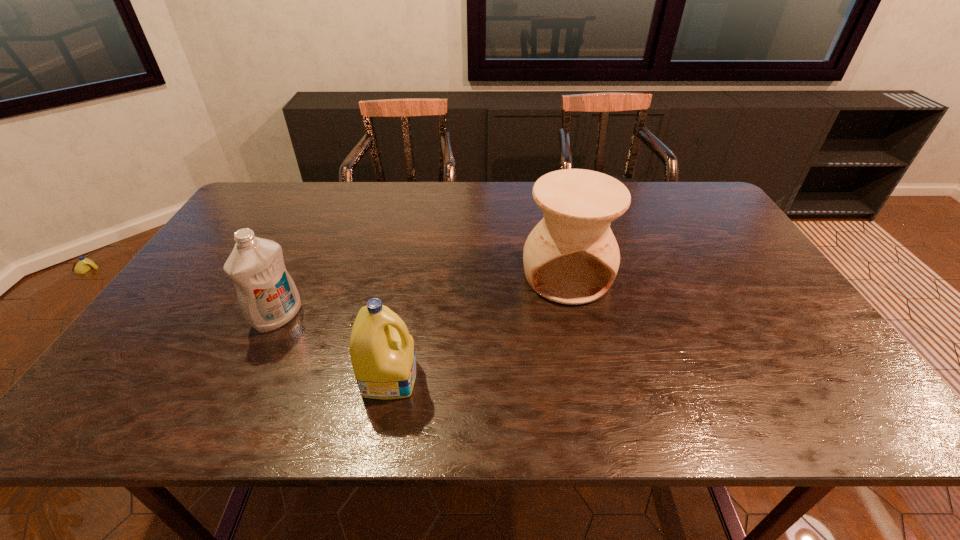
This screenshot has width=960, height=540. I want to click on free spot that satisfies the following two spatial constraints: 1. at the open side of the rightmost object; 2. on the label of the second object from left to right, so click(x=589, y=377).

Where is `blank space that satisfies the following two spatial constraints: 1. at the open side of the pottery; 2. on the label of the right detergent`? This screenshot has width=960, height=540. blank space that satisfies the following two spatial constraints: 1. at the open side of the pottery; 2. on the label of the right detergent is located at coordinates (589, 377).